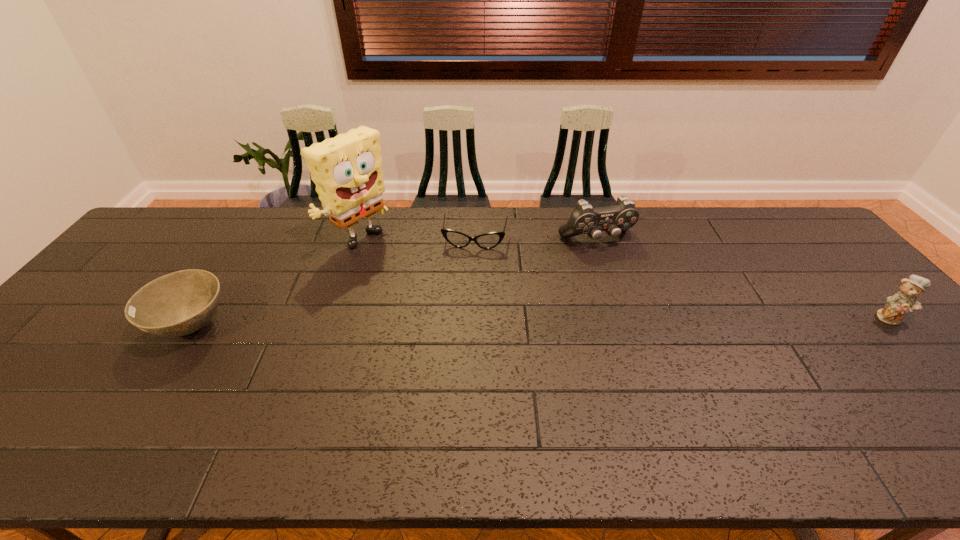
Find the location of a particular element. The image size is (960, 540). free spot on the desktop that is between the leftmost object and the rightmost object and is positioned on the face of the tallest object is located at coordinates (483, 323).

Where is `vacant spot on the desktop that is between the leftmost object and the rightmost object and is positioned on the surface of the control with buttons`? The width and height of the screenshot is (960, 540). vacant spot on the desktop that is between the leftmost object and the rightmost object and is positioned on the surface of the control with buttons is located at coordinates (647, 321).

Where is `free spot on the desktop that is between the second shortest object and the rightmost object and is positioned on the front-facing side of the third object from left to right`? Image resolution: width=960 pixels, height=540 pixels. free spot on the desktop that is between the second shortest object and the rightmost object and is positioned on the front-facing side of the third object from left to right is located at coordinates (462, 323).